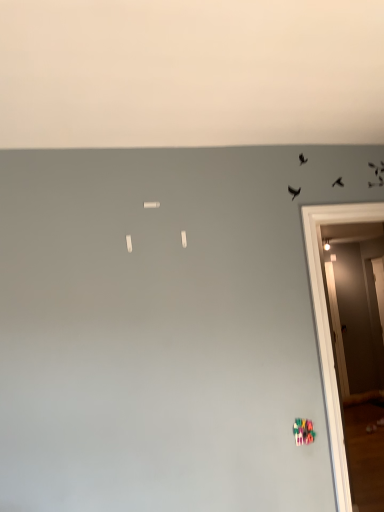
The width and height of the screenshot is (384, 512). What do you see at coordinates (328, 324) in the screenshot?
I see `white plastic door at right` at bounding box center [328, 324].

Where is `white plastic door at right`? Image resolution: width=384 pixels, height=512 pixels. white plastic door at right is located at coordinates (328, 324).

Image resolution: width=384 pixels, height=512 pixels. I want to click on white plastic door at right, so click(328, 324).